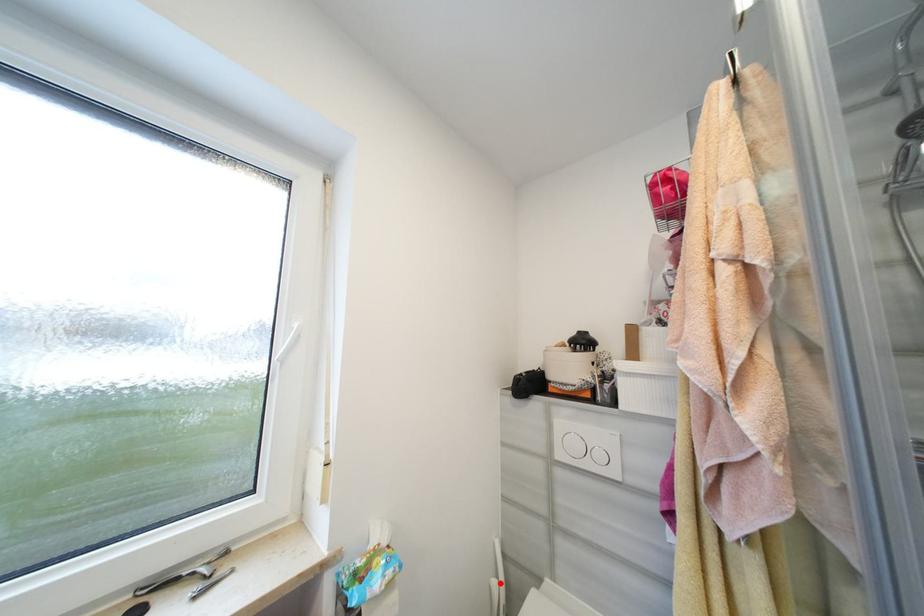
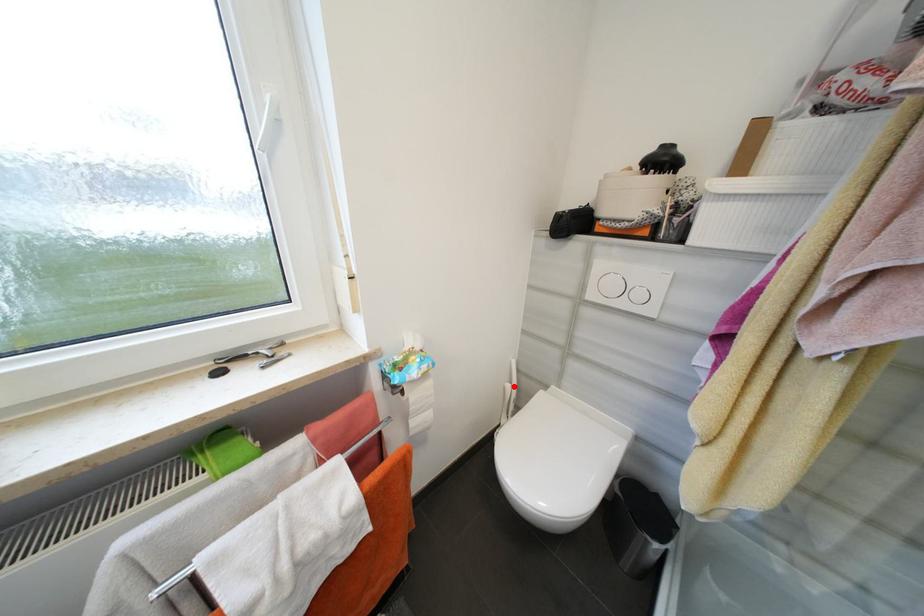
I am providing you with two images of the same scene from different viewpoints. A red point is marked on the first image and another point is marked on the second image. Are the points marked in image1 and image2 representing the same 3D position?

Yes